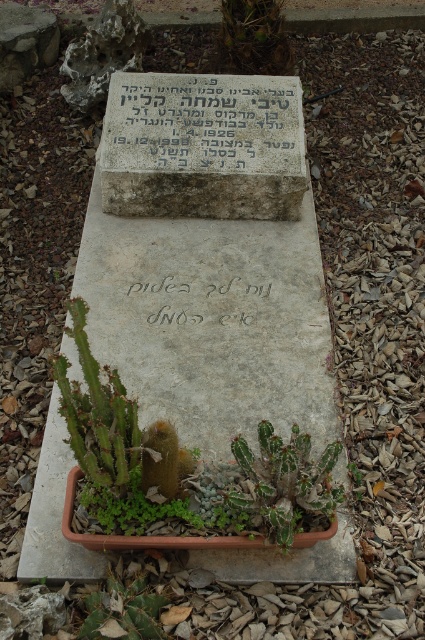
You are a gardener who wants to place a new flower pot in front of the tombstone. The flower pot must be shorter than the white stone writing at center. Can the green spiky cactus at lower center fit in this requirement?

The white stone writing at center is taller than the green spiky cactus at lower center, so the green spiky cactus at lower center is shorter and meets the requirement.